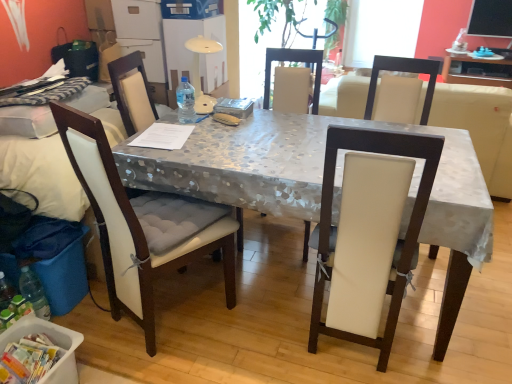
The width and height of the screenshot is (512, 384). Identify the location of free spot to the left of white leather chair at center, marked as the 1th chair in a right-to-left arrangement. (257, 329).